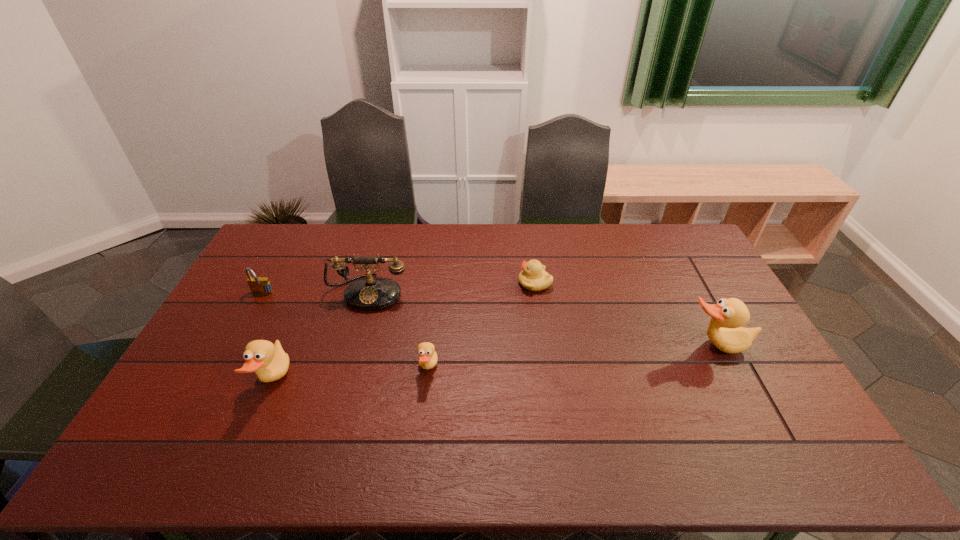
Identify the location of unoccupied position between the second duck from right to left and the fifth object from right to left. (350, 375).

At what (x,y) coordinates should I click in order to perform the action: click on vacant space that is in between the second shortest duck and the rightmost duck. Please return your answer as a coordinate pair (x, y). The height and width of the screenshot is (540, 960). Looking at the image, I should click on (x=494, y=364).

Identify the location of unoccupied position between the third object from left to right and the second duck from right to left. The image size is (960, 540). (398, 330).

Identify which object is located as the fifth nearest to the leftmost object. Please provide its 2D coordinates. Your answer should be formatted as a tuple, i.e. [(x, y)], where the tuple contains the x and y coordinates of a point satisfying the conditions above.

[(725, 331)]

Choose which object is the fifth nearest neighbor to the third object from left to right. Please provide its 2D coordinates. Your answer should be formatted as a tuple, i.e. [(x, y)], where the tuple contains the x and y coordinates of a point satisfying the conditions above.

[(725, 331)]

Point out which duck is positioned as the third nearest to the telephone. Please provide its 2D coordinates. Your answer should be formatted as a tuple, i.e. [(x, y)], where the tuple contains the x and y coordinates of a point satisfying the conditions above.

[(725, 331)]

Identify which duck is the closest to the shortest duck. Please provide its 2D coordinates. Your answer should be formatted as a tuple, i.e. [(x, y)], where the tuple contains the x and y coordinates of a point satisfying the conditions above.

[(269, 361)]

In order to click on vacant region that satisfies the following two spatial constraints: 1. on the beak of the duckling; 2. on the side with the combination dials of the leftmost object in this screenshot , I will do `click(537, 294)`.